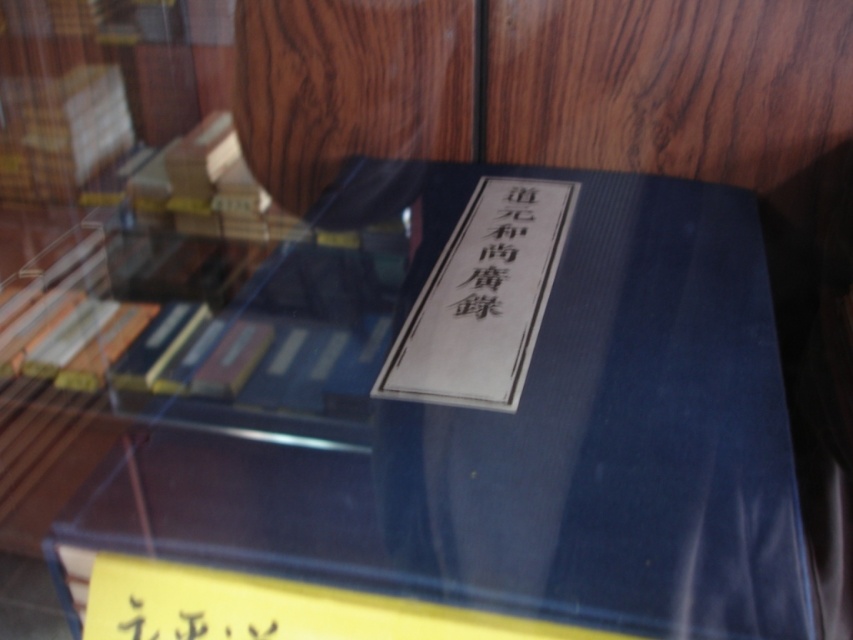
You are organizing a library and need to place the white paper book at center on a shelf. The shelf has a coordinate system where the bottom left corner is the origin. Can you confirm if the book is placed correctly at the coordinates provided?

The white paper book at center is located at point [482,298], so it is placed correctly at those coordinates on the shelf.

You are standing in a library and see the black paper at center. If you want to reach it, will you be able to touch it without moving your feet?

The black paper at center is 30.01 inches away from the viewer. Since the average person can reach about 28 inches, you would not be able to touch it without moving your feet.

You are organizing a library and need to place the white paper book at center and the black paper at center on a shelf. Given their sizes, which one should you place first to ensure proper arrangement?

The white paper book at center is larger in size than the black paper at center, so you should place the white paper book at center first to accommodate its larger size before positioning the smaller black paper at center.